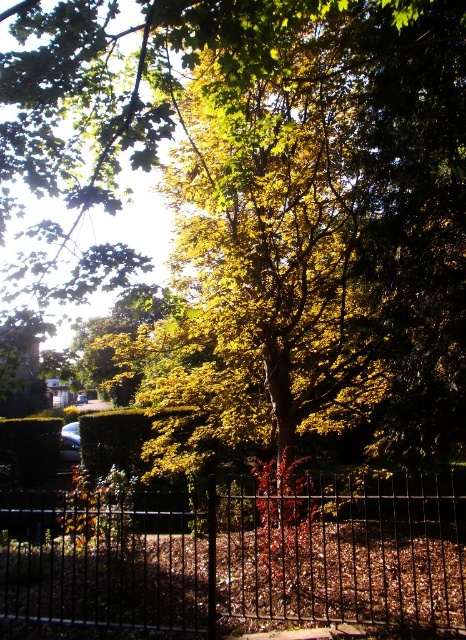
Can you confirm if black metal fence at lower center is positioned to the left of green leafy hedge at lower left?

No, black metal fence at lower center is not to the left of green leafy hedge at lower left.

Which of these two, black metal fence at lower center or green leafy hedge at lower left, stands taller?

green leafy hedge at lower left is taller.

This screenshot has height=640, width=466. What do you see at coordinates (244, 556) in the screenshot?
I see `black metal fence at lower center` at bounding box center [244, 556].

I want to click on black metal fence at lower center, so click(x=244, y=556).